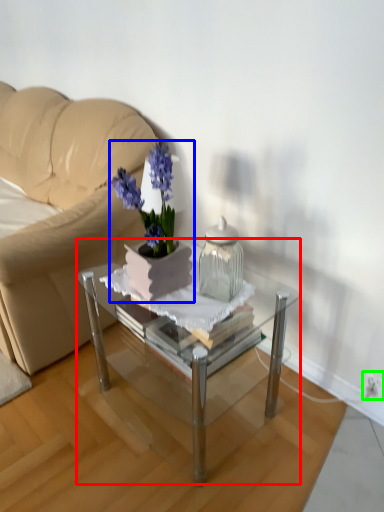
Question: Which object is positioned closest to coffee table (highlighted by a red box)? Select from houseplant (highlighted by a blue box) and electric outlet (highlighted by a green box).

Choices:
 (A) houseplant
 (B) electric outlet

Answer: (A)